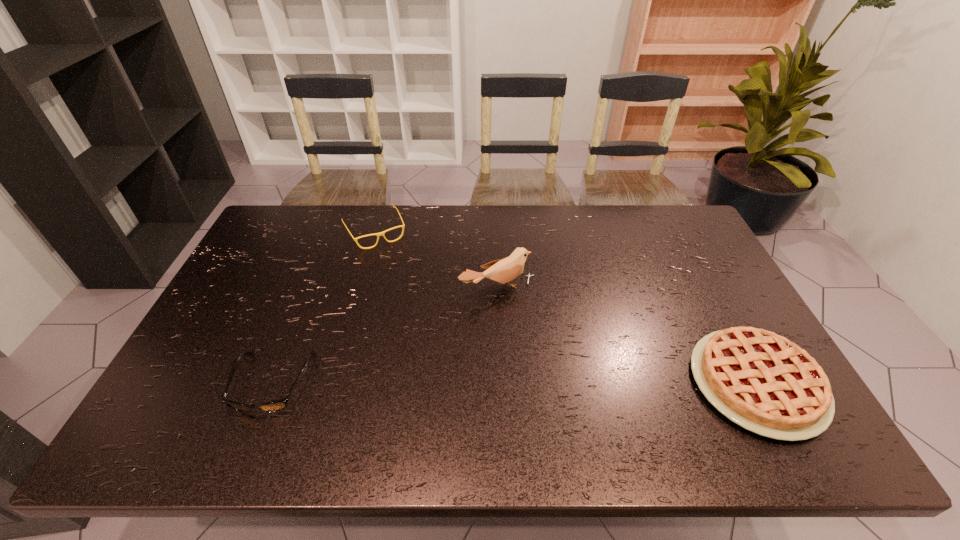
The width and height of the screenshot is (960, 540). In order to click on free space between the pie and the farther spectacles in this screenshot , I will do `click(565, 307)`.

This screenshot has width=960, height=540. I want to click on empty space that is in between the farther spectacles and the nearer spectacles, so click(x=324, y=307).

Find the location of `free space between the nearer spectacles and the pie`. free space between the nearer spectacles and the pie is located at coordinates (515, 383).

The image size is (960, 540). Find the location of `vacant region between the nearer spectacles and the bird`. vacant region between the nearer spectacles and the bird is located at coordinates (385, 336).

Locate an element on the screen. free space that is in between the bird and the farther spectacles is located at coordinates (436, 260).

This screenshot has height=540, width=960. Identify the location of the closest object relative to the farther spectacles. (504, 270).

Find the location of a particular element. This screenshot has width=960, height=540. the third closest object to the bird is located at coordinates (274, 406).

Find the location of `vacant region that satisfies the following two spatial constraints: 1. on the front side of the bird; 2. on the left side of the rightmost object`. vacant region that satisfies the following two spatial constraints: 1. on the front side of the bird; 2. on the left side of the rightmost object is located at coordinates (501, 383).